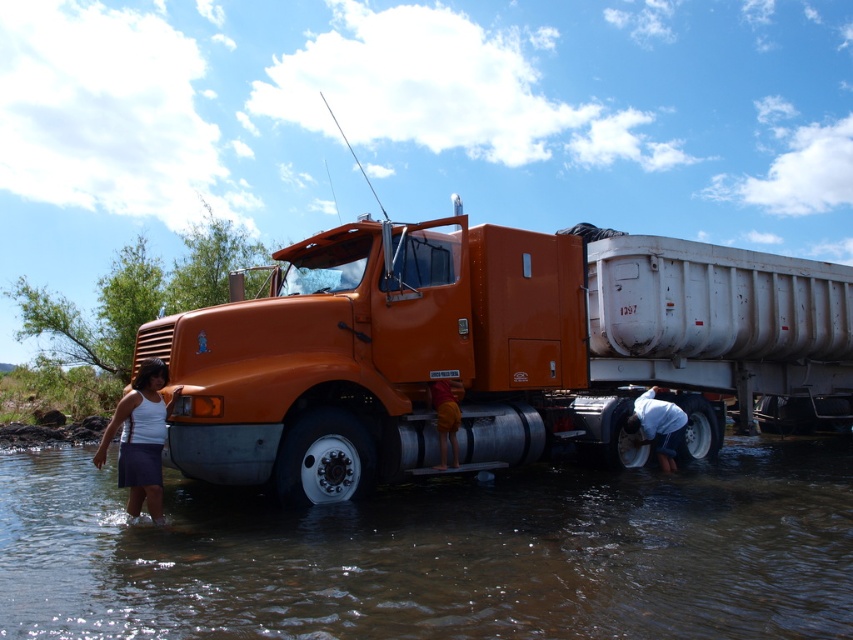
You are a photographer trying to capture a clear photo of the orange matte truck at center and the orange fabric pants at lower center. Since both are orange, you want to ensure they are positioned so one doesn not block the other. Based on the scene, which object is closer to you, making it possible to frame them without overlap?

The orange matte truck at center is in front of orange fabric pants at lower center, so the truck is closer to you, allowing you to frame them without overlap by positioning the truck in front without blocking the pants.

You are a photographer trying to capture the scene of the large orange semi truck submerged in water. You notice the brown muddy water at lower center and the white fabric skirt at lower left. Which object is positioned closer to your camera lens?

The brown muddy water at lower center is closer to the viewer than the white fabric skirt at lower left, so the brown muddy water at lower center would be closer to the camera lens.

You are standing at the edge of the scene and want to cross the brown muddy water at lower center. What coordinates should you aim for to cross safely?

To cross the brown muddy water at lower center safely, aim for the coordinates point at (440,554) where the brown muddy water at lower center is located.